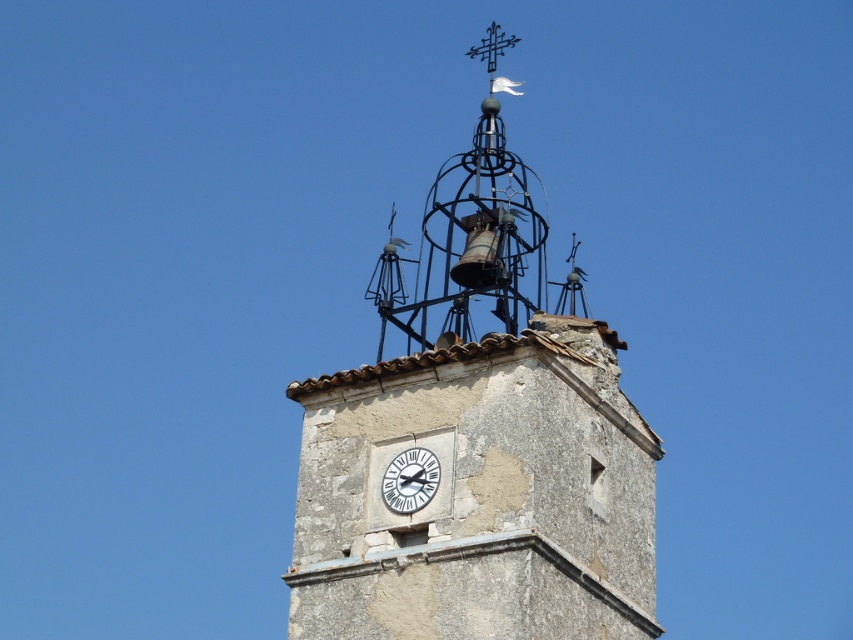
Question: Is black wrought iron spire at upper center wider than white stone clock at center?

Choices:
 (A) yes
 (B) no

Answer: (A)

Question: Is stone clock tower at center smaller than white stone clock at center?

Choices:
 (A) yes
 (B) no

Answer: (B)

Question: Estimate the real-world distances between objects in this image. Which object is farther from the black wrought iron spire at upper center?

Choices:
 (A) white stone clock at center
 (B) stone clock tower at center

Answer: (A)

Question: Which of the following is the closest to the observer?

Choices:
 (A) (294, 538)
 (B) (509, 212)
 (C) (421, 502)

Answer: (C)

Question: Does black wrought iron spire at upper center have a smaller size compared to white stone clock at center?

Choices:
 (A) yes
 (B) no

Answer: (B)

Question: Which point is farther to the camera?

Choices:
 (A) (476, 621)
 (B) (492, 141)
 (C) (430, 451)

Answer: (B)